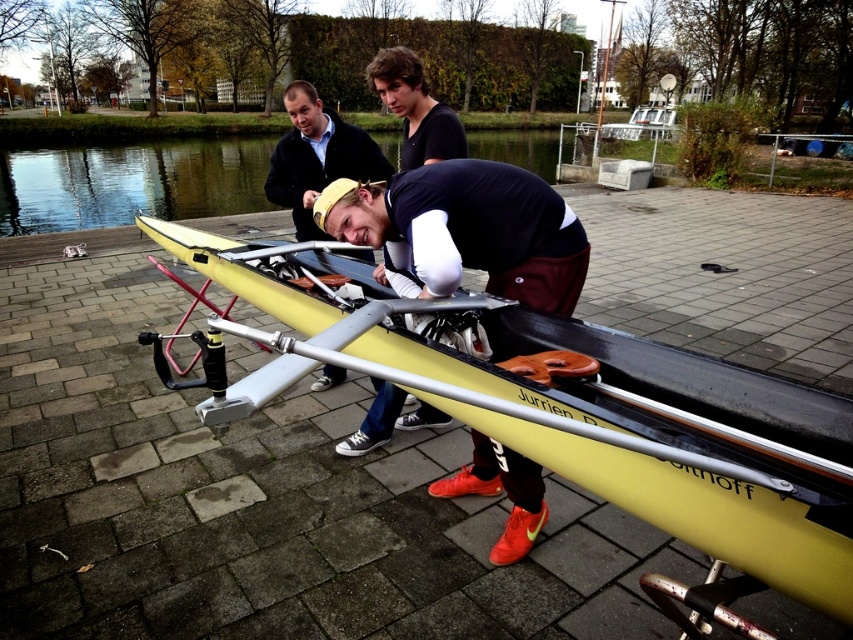
You are standing at the starting point of a race and see two points marked on the ground. The first point is at point (630,400) and the second point is at point (413,417). Which point is closer to you?

Point (630,400) is in front of point (413,417), so it is closer to you.

You are standing at point (810, 422) and want to reach the yellow rowing boat on the metal rack. The boat is 1.80 meters away from you. If you have a 2.0 meter long pole, can you safely reach the boat without moving from your current position?

The boat is 1.80 meters away from point (810, 422). Since the pole is 2.0 meters long, which is longer than the distance to the boat, you can safely reach it without moving.

You are planning to take a photo of the yellow matte boat at center and the clear water at center. Which object should you focus on if you want to capture the larger subject in your shot?

The clear water at center is larger than the yellow matte boat at center, so you should focus on the clear water at center to capture the larger subject.